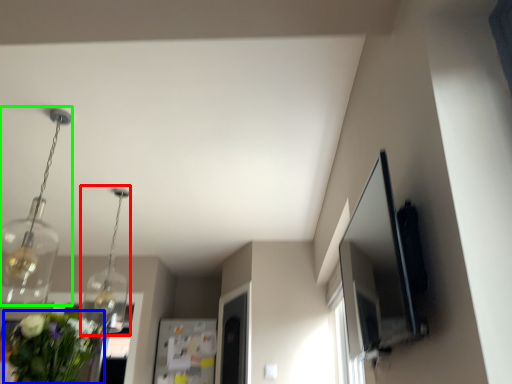
Question: Which is farther away from light fixture (highlighted by a red box)? floral arrangement (highlighted by a blue box) or light fixture (highlighted by a green box)?

Choices:
 (A) floral arrangement
 (B) light fixture

Answer: (A)